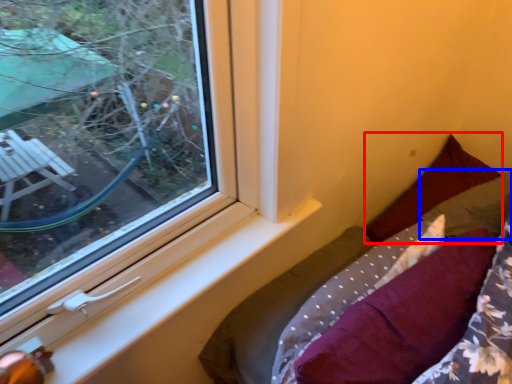
Question: Which object is further to the camera taking this photo, pillow (highlighted by a red box) or pillow (highlighted by a blue box)?

Choices:
 (A) pillow
 (B) pillow

Answer: (B)